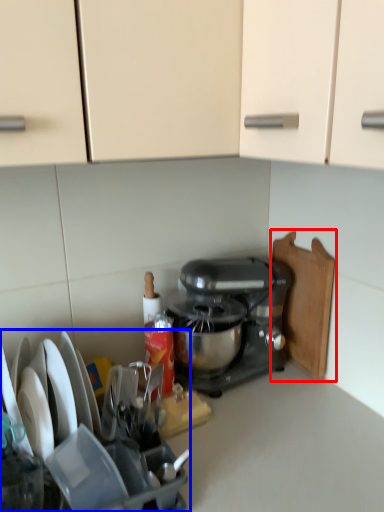
Question: Which object appears farthest to the camera in this image, cutting board (highlighted by a red box) or appliance (highlighted by a blue box)?

Choices:
 (A) cutting board
 (B) appliance

Answer: (A)